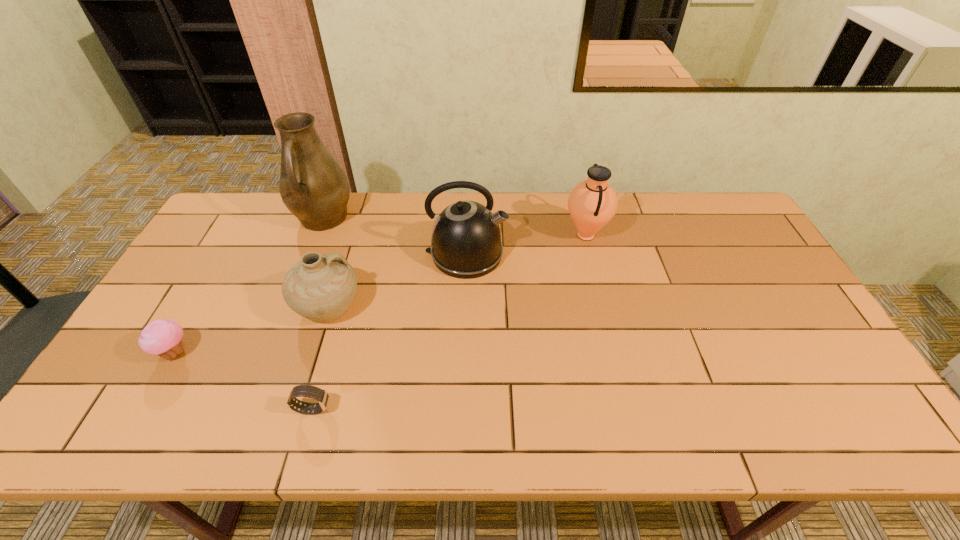
Where is `the taller pitcher`? the taller pitcher is located at coordinates (313, 186).

The height and width of the screenshot is (540, 960). Find the location of `the left pitcher`. the left pitcher is located at coordinates (313, 186).

What are the coordinates of `the fifth object from left to right` in the screenshot? It's located at (466, 243).

Image resolution: width=960 pixels, height=540 pixels. I want to click on the shorter pitcher, so click(x=592, y=203).

The width and height of the screenshot is (960, 540). Identify the location of the rightmost object. (592, 203).

I want to click on the fourth tallest object, so click(x=320, y=287).

Where is `the fourth farthest object`? The height and width of the screenshot is (540, 960). the fourth farthest object is located at coordinates (320, 287).

Where is `the fifth tallest object`? The width and height of the screenshot is (960, 540). the fifth tallest object is located at coordinates (163, 337).

Find the location of `the leftmost object`. the leftmost object is located at coordinates (163, 337).

Where is `the shortest object`? the shortest object is located at coordinates (321, 396).